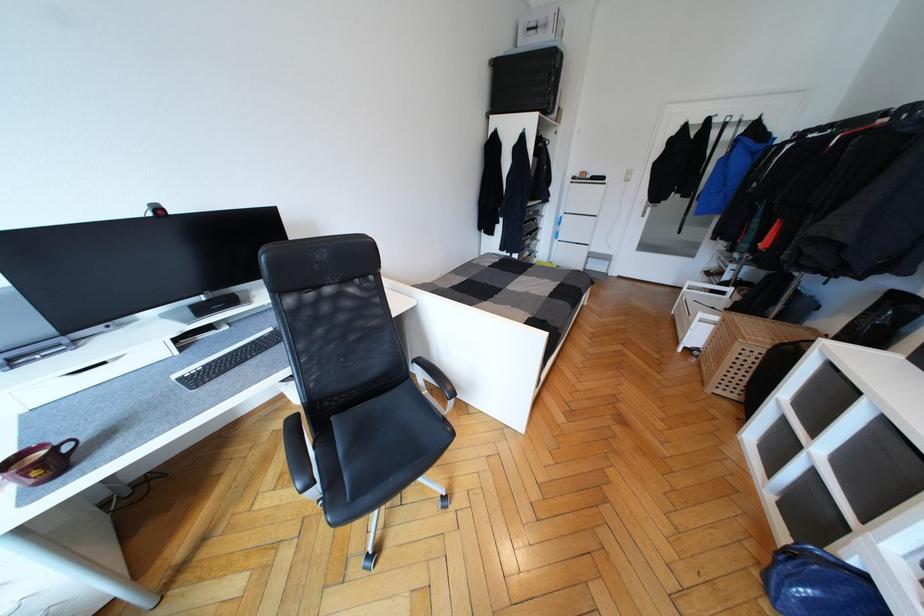
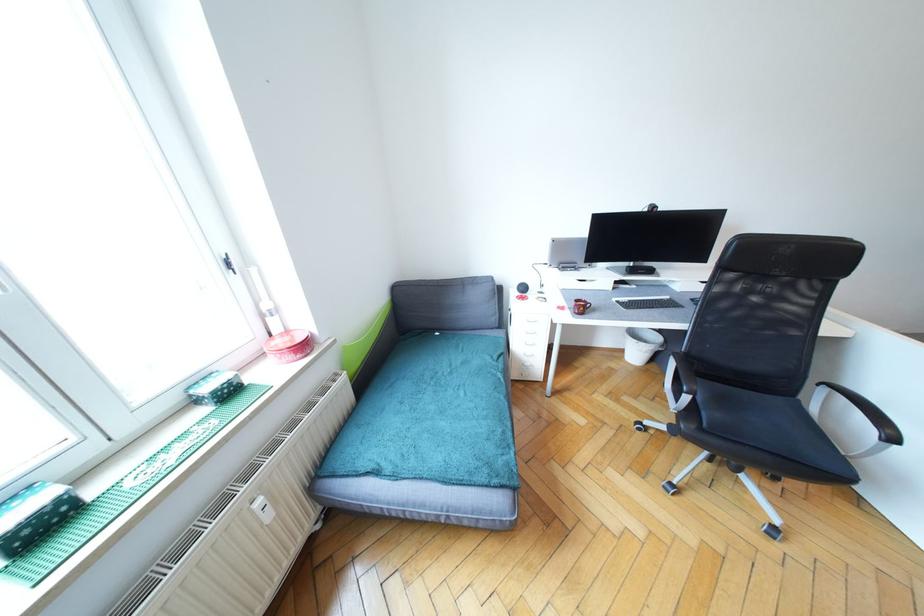
Question: The camera is either moving clockwise (left) or counter-clockwise (right) around the object. The first image is from the beginning of the video and the second image is from the end. Is the camera moving left or right when shooting the video?

Choices:
 (A) Left
 (B) Right

Answer: (B)